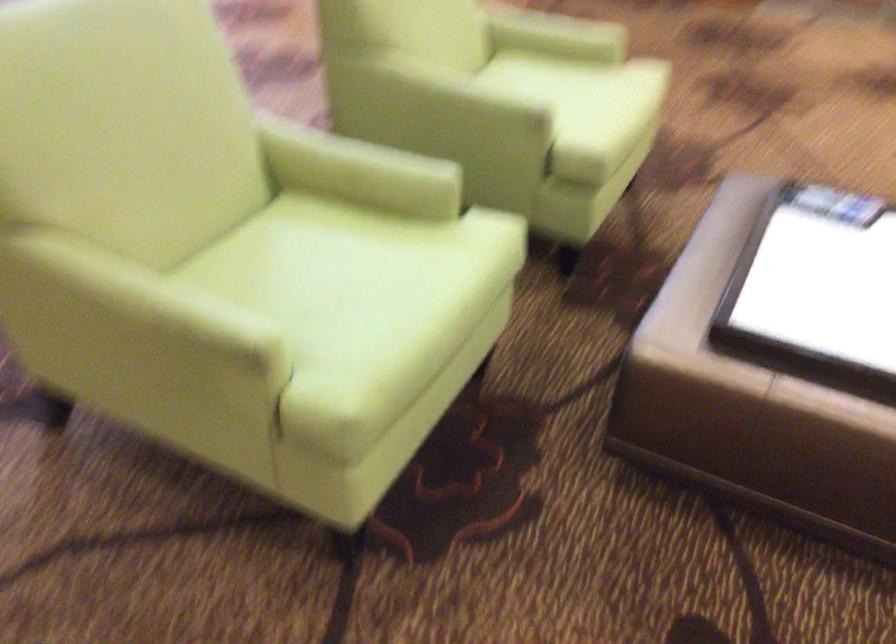
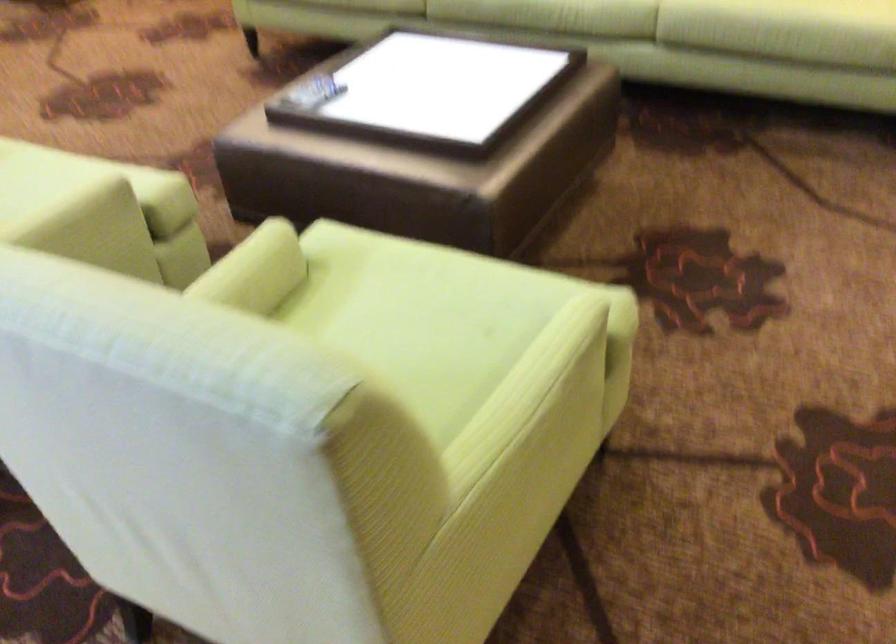
Where in the second image is the point corresponding to point 330,278 from the first image?

(410, 328)